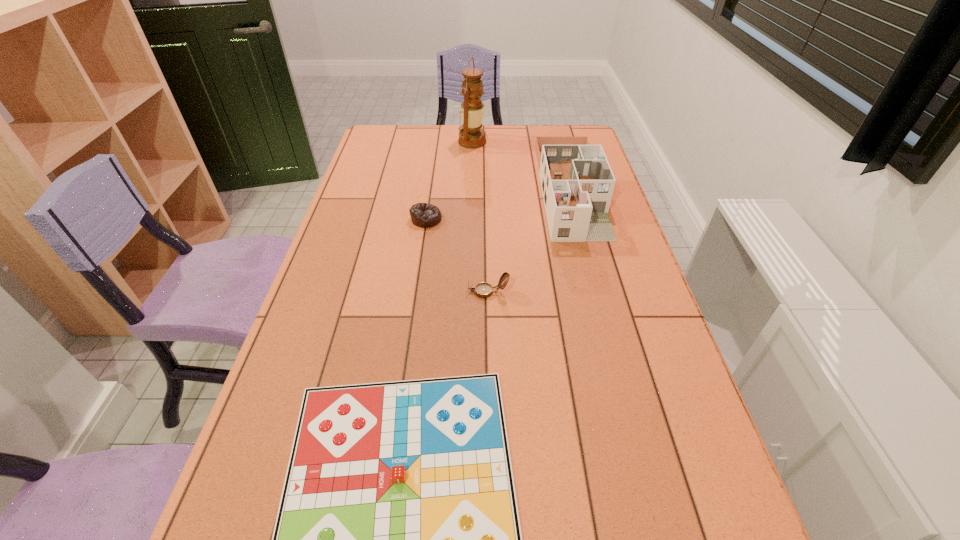
You are a GUI agent. You are given a task and a screenshot of the screen. Output one action in this format:
    pyautogui.click(x=<x>, y=<y>)
    Task: Click on the tallest object
    This screenshot has height=540, width=960.
    Given the screenshot: What is the action you would take?
    pyautogui.click(x=472, y=110)

What are the coordinates of `the rightmost object` in the screenshot? It's located at (577, 183).

The height and width of the screenshot is (540, 960). Identify the location of dollhouse. (577, 183).

The height and width of the screenshot is (540, 960). What are the coordinates of `the third shortest object` in the screenshot? It's located at (483, 290).

Where is `the second nearest object`? the second nearest object is located at coordinates (483, 290).

At what (x,y) coordinates should I click in order to perform the action: click on the second shortest object. Please return your answer as a coordinate pair (x, y). Looking at the image, I should click on (423, 215).

At what (x,y) coordinates should I click in order to perform the action: click on vacant area situated on the right of the oil lamp. Please return your answer as a coordinate pair (x, y). Looking at the image, I should click on (538, 141).

Identify the location of free space located at the front door of the rightmost object. The width and height of the screenshot is (960, 540). (591, 267).

Locate an element on the screen. The height and width of the screenshot is (540, 960). vacant space located on the face of the compass is located at coordinates (376, 292).

Find the location of a particular element. Image resolution: width=960 pixels, height=540 pixels. free region located on the face of the compass is located at coordinates (427, 292).